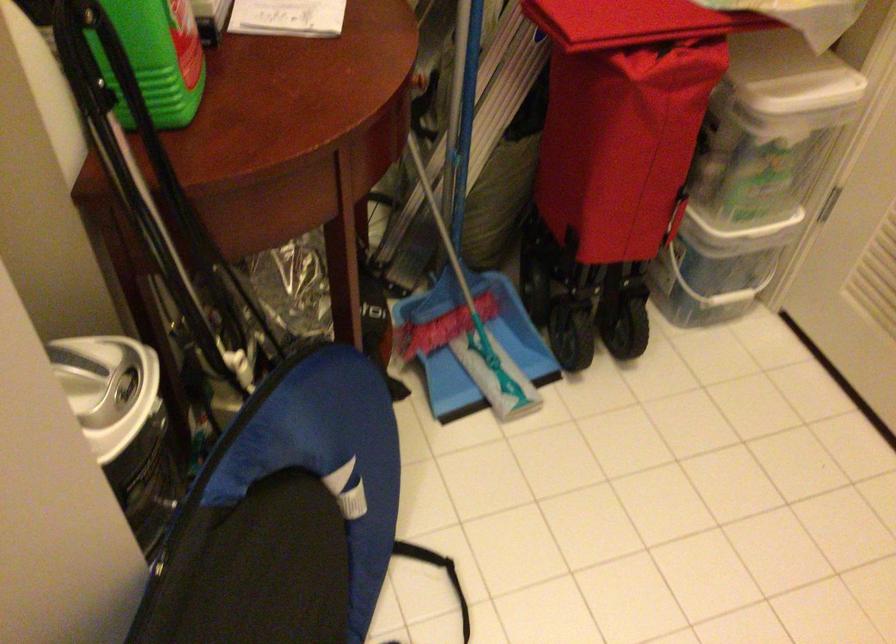
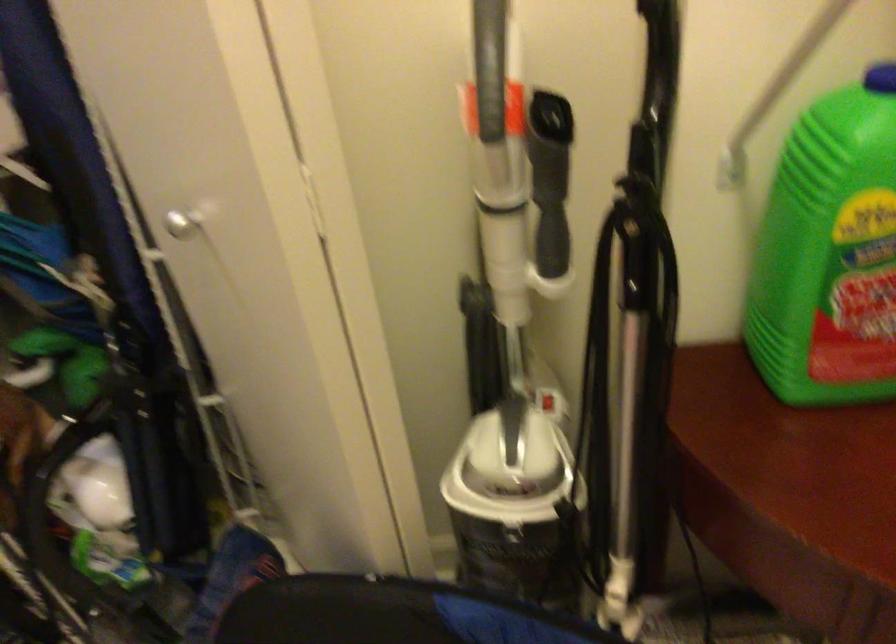
The point at (125,142) is marked in the first image. Where is the corresponding point in the second image?

(633, 348)